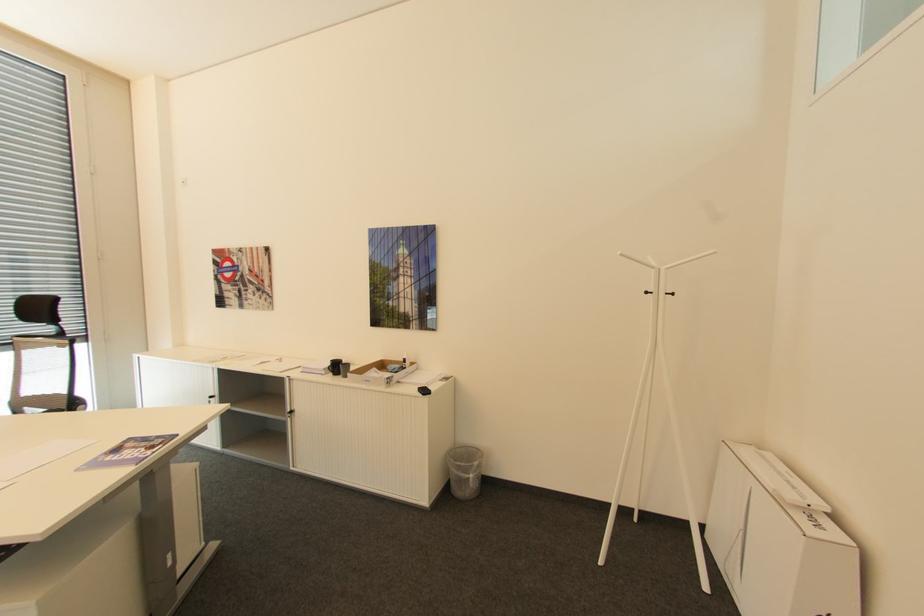
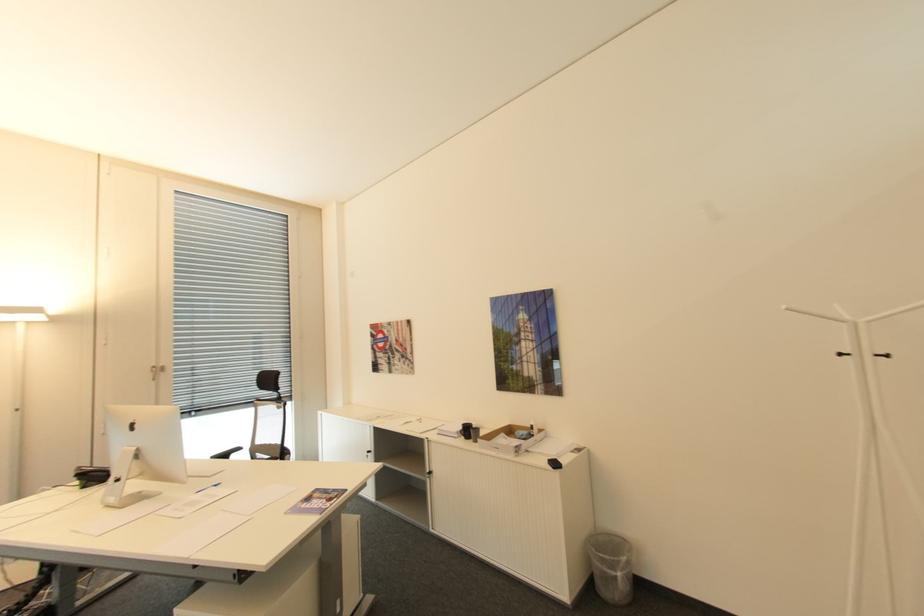
Locate, in the second image, the point that corresponds to [623,252] in the first image.

(791, 307)